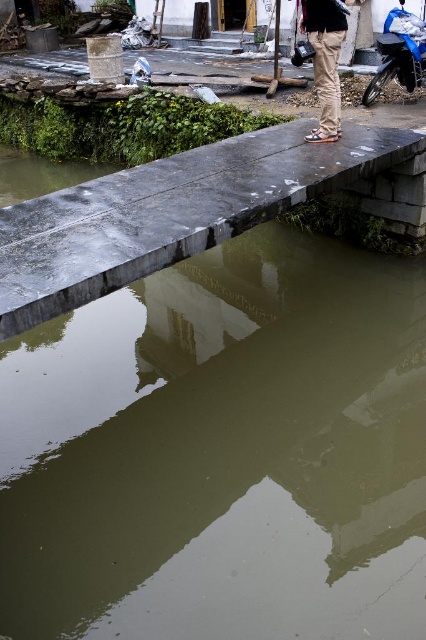
You are standing on the narrow stone bridge and notice the greenish murky water at center and the khaki cotton pants at center. Which object takes up more space in the scene?

The khaki cotton pants at center takes up more space in the scene because it is larger than the greenish murky water at center.

You are a photographer standing on the narrow stone bridge. You want to capture a photo that includes both the greenish murky water at center and the blue matte motorcycle at upper right. Which object should you focus on first if you want to ensure both are in the frame?

The greenish murky water at center is smaller than the blue matte motorcycle at upper right, so you should focus on the blue matte motorcycle at upper right first to ensure it fits in the frame, then adjust to include the smaller greenish murky water at center.

From the picture: You are a photographer positioned on the narrow stone bridge. You notice the khaki cotton pants at center and the blue matte motorcycle at upper right. Which object is closer to the left side of the bridge?

The khaki cotton pants at center is to the left of the blue matte motorcycle at upper right, so it is closer to the left side of the bridge.